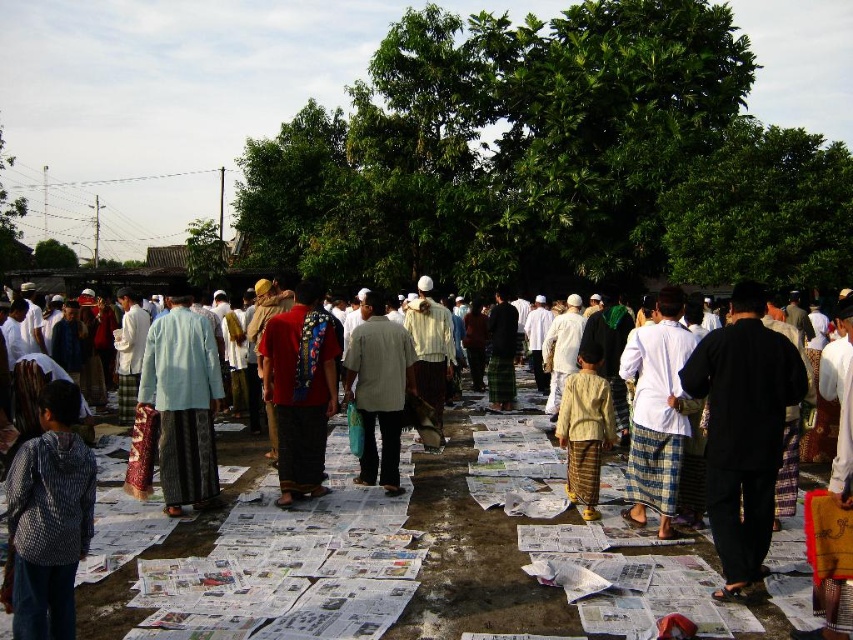
Who is shorter, checkered fabric shirt at lower left or red fabric bag at center?

Standing shorter between the two is checkered fabric shirt at lower left.

Does checkered fabric shirt at lower left have a larger size compared to red fabric bag at center?

Incorrect, checkered fabric shirt at lower left is not larger than red fabric bag at center.

Does point (53, 452) come closer to viewer compared to point (309, 493)?

Yes, point (53, 452) is in front of point (309, 493).

This screenshot has width=853, height=640. Identify the location of checkered fabric shirt at lower left. (48, 518).

Who is higher up, light blue fabric at center or white woven cloth at center?

white woven cloth at center

Can you confirm if light blue fabric at center is shorter than white woven cloth at center?

Yes.

Is point (177, 477) less distant than point (659, 358)?

Yes.

Identify the location of light blue fabric at center. The width and height of the screenshot is (853, 640). (183, 401).

Between checkered fabric shirt at lower left and light blue fabric at center, which one is positioned higher?

Positioned higher is light blue fabric at center.

Is checkered fabric shirt at lower left shorter than light blue fabric at center?

Yes.

Is point (47, 429) closer to camera compared to point (163, 376)?

Yes, it is in front of point (163, 376).

Find the location of a particular element. checkered fabric shirt at lower left is located at coordinates (48, 518).